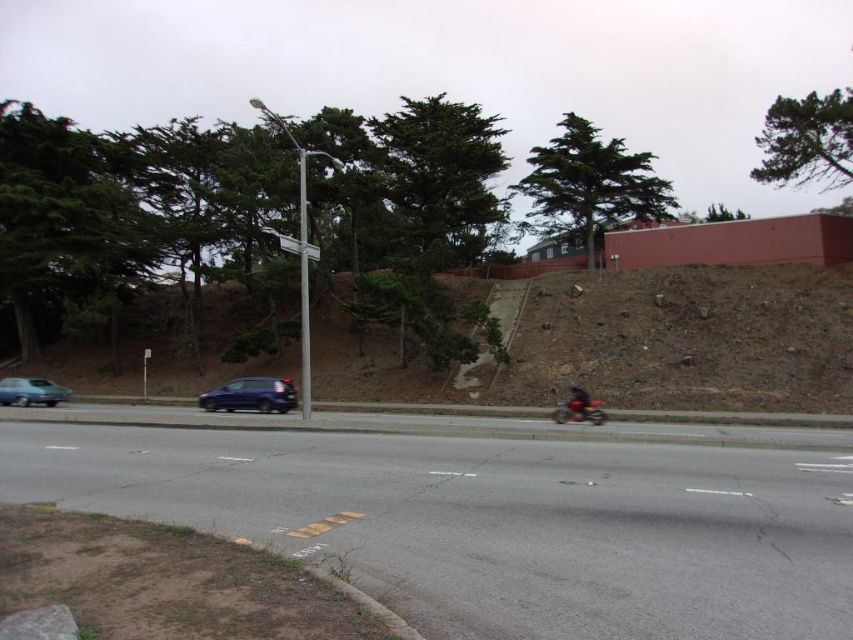
Can you confirm if asphalt road at center is wider than white plastic street sign at upper center?

Yes, asphalt road at center is wider than white plastic street sign at upper center.

Is asphalt road at center closer to the viewer compared to white plastic street sign at upper center?

That is True.

Is point (737, 580) positioned before point (285, 246)?

Yes, point (737, 580) is closer to viewer.

At what (x,y) coordinates should I click in order to perform the action: click on asphalt road at center. Please return your answer as a coordinate pair (x, y). This screenshot has width=853, height=640. Looking at the image, I should click on (495, 522).

Does asphalt road at center have a larger size compared to shiny black motorcycle at right?

Yes, asphalt road at center is bigger than shiny black motorcycle at right.

Does asphalt road at center lie in front of shiny black motorcycle at right?

Yes.

Which is behind, point (241, 436) or point (575, 410)?

Point (575, 410)

Where is `asphalt road at center`? asphalt road at center is located at coordinates (495, 522).

Between green textured tree at upper center and green leafy tree at upper right, which one is positioned higher?

green leafy tree at upper right

Does point (573, 216) come behind point (778, 134)?

Yes, point (573, 216) is farther from viewer.

The height and width of the screenshot is (640, 853). What do you see at coordinates (592, 182) in the screenshot?
I see `green textured tree at upper center` at bounding box center [592, 182].

The height and width of the screenshot is (640, 853). In order to click on green textured tree at upper center in this screenshot , I will do `click(592, 182)`.